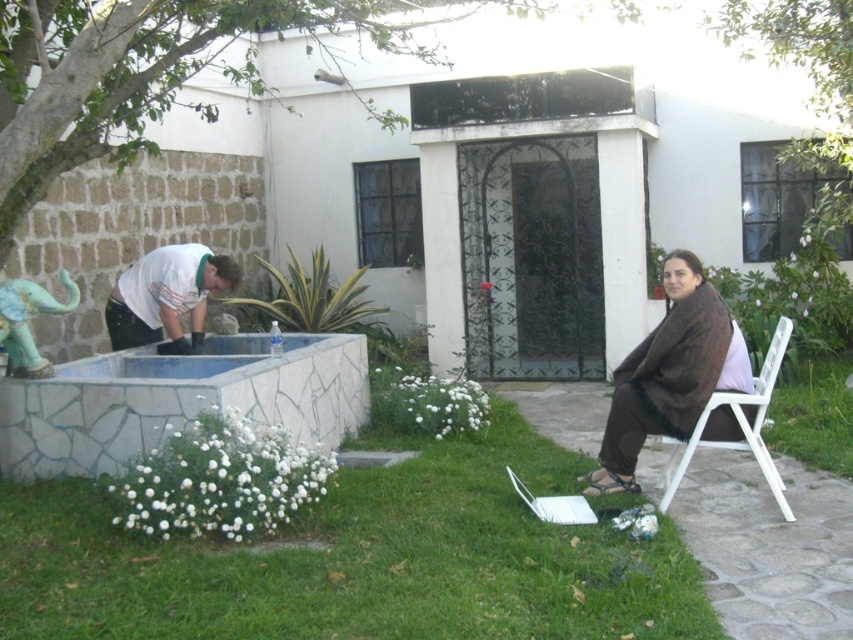
Question: Does brown fabric at right appear over white plastic chair at lower right?

Choices:
 (A) yes
 (B) no

Answer: (A)

Question: Estimate the real-world distances between objects in this image. Which object is closer to the brown fabric at right?

Choices:
 (A) white plastic chair at lower right
 (B) green grass at lower center

Answer: (A)

Question: Among these points, which one is farthest from the camera?

Choices:
 (A) (190, 268)
 (B) (196, 563)
 (C) (763, 403)
 (D) (630, 365)

Answer: (A)

Question: Among these objects, which one is farthest from the camera?

Choices:
 (A) white t-shirt at left
 (B) green grass at lower center

Answer: (A)

Question: Can you confirm if green grass at lower center is positioned below white plastic chair at lower right?

Choices:
 (A) no
 (B) yes

Answer: (B)

Question: Is white t-shirt at left positioned at the back of white plastic chair at lower right?

Choices:
 (A) yes
 (B) no

Answer: (A)